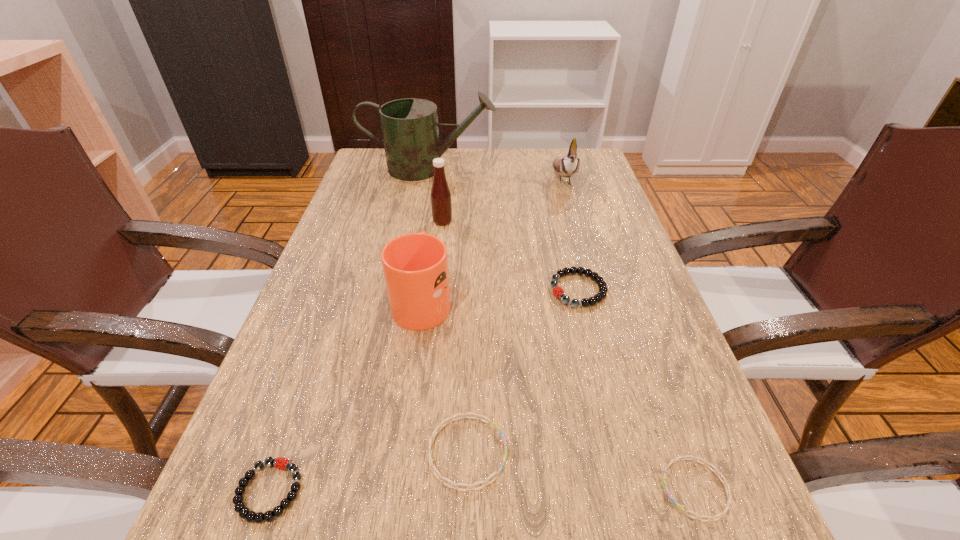
Where is `vacant space located 0.200m on the back of the farthest bracelet`? The image size is (960, 540). vacant space located 0.200m on the back of the farthest bracelet is located at coordinates (561, 221).

At what (x,y) coordinates should I click in order to perform the action: click on free space located 0.330m on the surface of the left blue bracelet showing star-shaped elements. Please return your answer as a coordinate pair (x, y). Looking at the image, I should click on (727, 452).

This screenshot has height=540, width=960. Find the location of `vacant space located 0.070m on the back of the nearer black bracelet`. vacant space located 0.070m on the back of the nearer black bracelet is located at coordinates (296, 417).

Image resolution: width=960 pixels, height=540 pixels. What are the coordinates of `free spot located 0.210m on the surface of the right blue bracelet showing star-shaped elements` in the screenshot? It's located at (515, 489).

Where is `free spot located 0.050m on the surface of the right blue bracelet showing star-shaped elements`? This screenshot has width=960, height=540. free spot located 0.050m on the surface of the right blue bracelet showing star-shaped elements is located at coordinates (628, 489).

I want to click on free spot located 0.190m on the surface of the right blue bracelet showing star-shaped elements, so click(529, 489).

Image resolution: width=960 pixels, height=540 pixels. What are the coordinates of `watering can present at the far edge` in the screenshot? It's located at (410, 131).

Where is `bird at the far edge`? Image resolution: width=960 pixels, height=540 pixels. bird at the far edge is located at coordinates (566, 166).

Find the location of `watering can that is at the left edge`. watering can that is at the left edge is located at coordinates (410, 131).

At what (x,y) coordinates should I click in order to perform the action: click on bracelet that is at the left edge. Please return your answer as a coordinate pair (x, y). The height and width of the screenshot is (540, 960). Looking at the image, I should click on (244, 512).